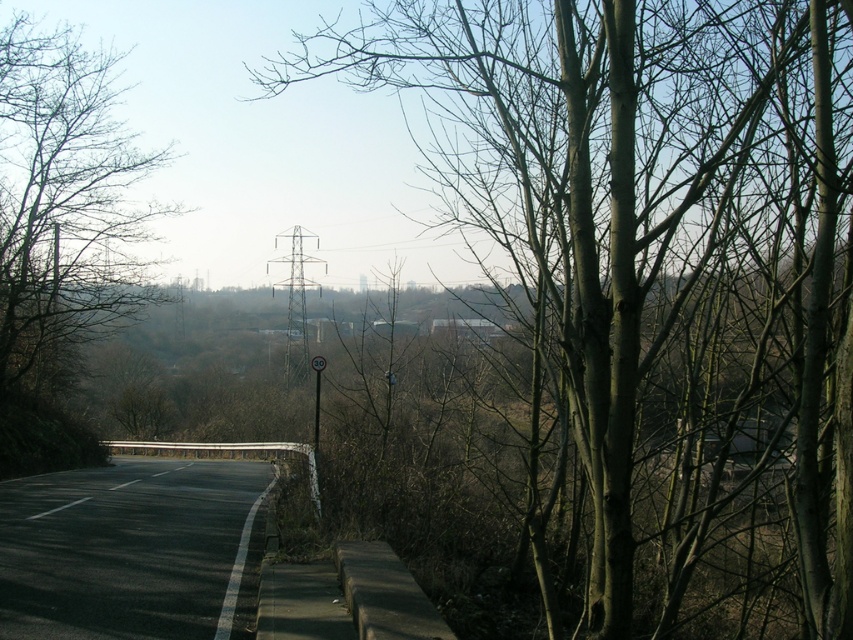
You are standing at the point marked by point (x=653, y=280) in the rural road scene. Looking around, you see a brown rough tree at center. Which direction should you face to see the metal guardrail running along the road edge?

The metal guardrail is on the right side of the road. Since you are at point (x=653, y=280) which marks the brown rough tree at center, facing towards the right side of the road will allow you to see the metal guardrail running along the road edge.

You are a pedestrian standing on the sidewalk and see the bare branches at left and the black asphalt highway at lower left. Which object is closer to the highway?

The bare branches at left are positioned over the black asphalt highway at lower left, so they are closer to the highway than the highway itself.